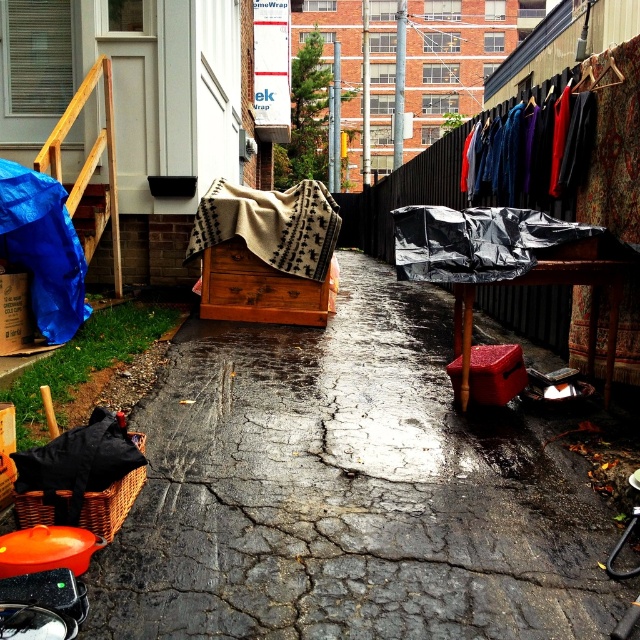
You are a delivery person trying to place a large package on the ground in the alleyway. The package is 1.2 meters wide. You see the beige textured blanket at center and the wooden chest at center. Can the package fit on the space between these two items?

The beige textured blanket at center is wider than the wooden chest at center. Since the package is 1.2 meters wide, it depends on the actual width of the space between them. However, since the blanket is wider, the space between them might be sufficient. Unfortunately, without exact measurements, we can only infer based on relative sizes. If the combined width of both objects is less than 1.2 meters, then the space between them could accommodate the package. However, since the blanket is wider, it might be

You are a delivery person who needs to place a package between the beige textured blanket at center and the wooden chest at center. The package is 8 inches long. Can you fit it between them without moving either object?

The distance between the beige textured blanket at center and the wooden chest at center is 7.97 inches. Since the package is 8 inches long, it is slightly too long to fit between them without moving either object.